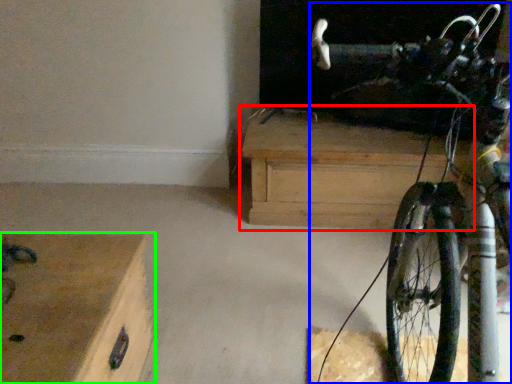
Question: Which object is the closest to the chest of drawers (highlighted by a red box)? Choose among these: bicycle (highlighted by a blue box) or chest of drawers (highlighted by a green box).

Choices:
 (A) bicycle
 (B) chest of drawers

Answer: (A)